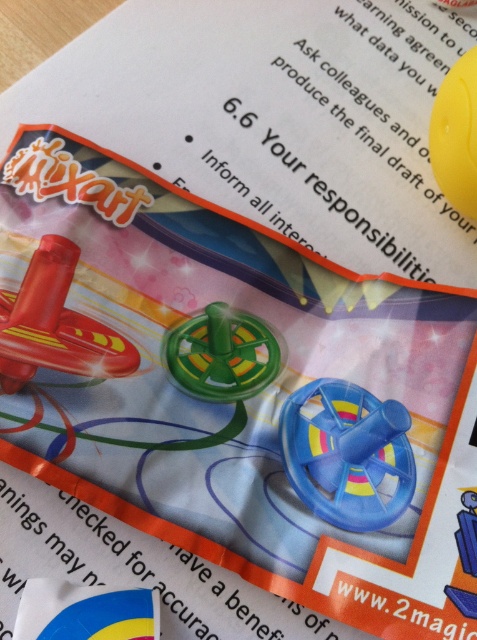
You are holding the promotional material for Mixart and notice the blue glossy flag at lower left and the yellow rubber ball at upper right. Which object is positioned closer to your eyes?

The blue glossy flag at lower left is closer to the viewer than the yellow rubber ball at upper right.

You are designing a layout for a new promotional flyer and need to place two elements from the Mixart material. The elements are the shiny red toy airplane at upper left and the blue glossy flag at lower left. According to the original design, which element is placed more to the left side?

The shiny red toy airplane at upper left is positioned on the left side of the blue glossy flag at lower left, so it is more to the left.

You are designing a layout for a new product and need to ensure proper spacing between the green plastic gear at center and the blue glossy flag at lower left. Given their sizes, which object should be placed higher to maintain visual balance?

The green plastic gear at center has a greater height compared to the blue glossy flag at lower left, so placing it higher would help maintain visual balance by compensating for its larger size.